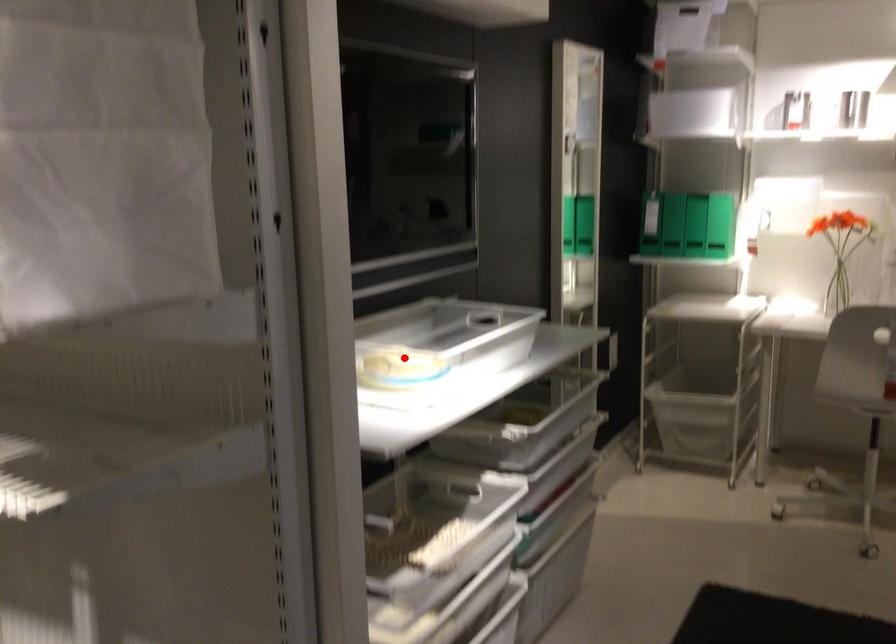
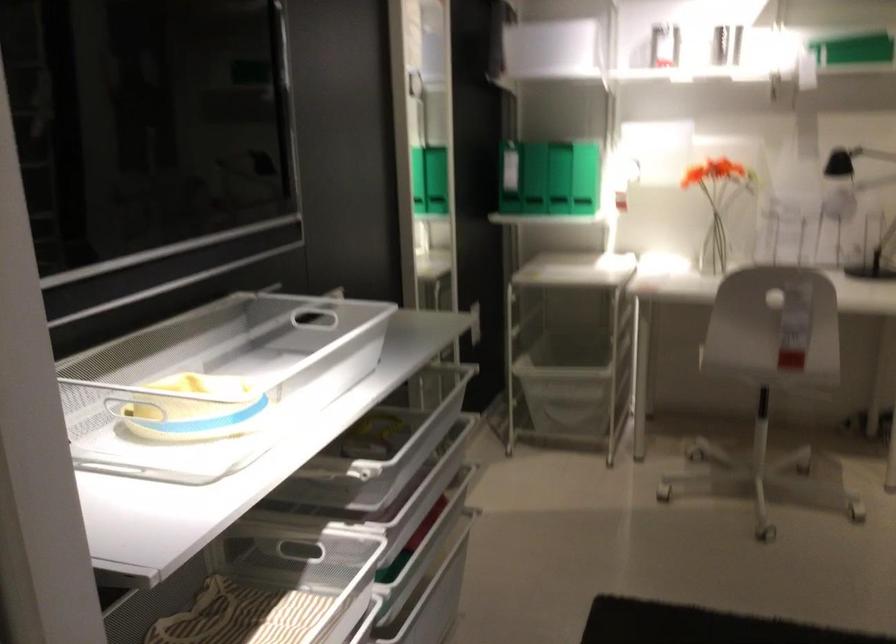
Question: A red point is marked in image1. In image2, is the corresponding 3D point closer to the camera or farther? Reply with the corresponding letter.

Choices:
 (A) The corresponding 3D point is closer.
 (B) The corresponding 3D point is farther.

Answer: (A)